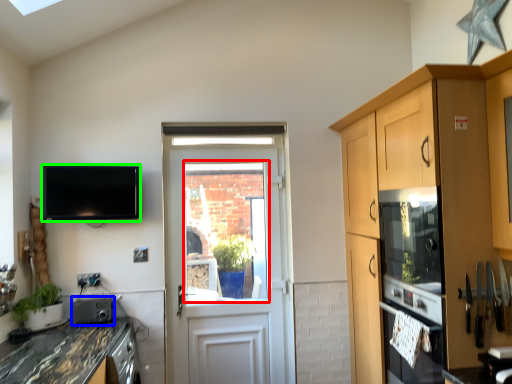
Question: Which object is the closest to the window screen (highlighted by a red box)? Choose among these: appliance (highlighted by a blue box) or television (highlighted by a green box).

Choices:
 (A) appliance
 (B) television

Answer: (B)